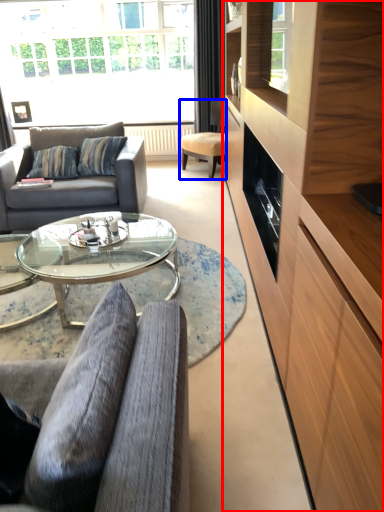
Question: Which of the following is the closest to the observer, cabinetry (highlighted by a red box) or chair (highlighted by a blue box)?

Choices:
 (A) cabinetry
 (B) chair

Answer: (A)